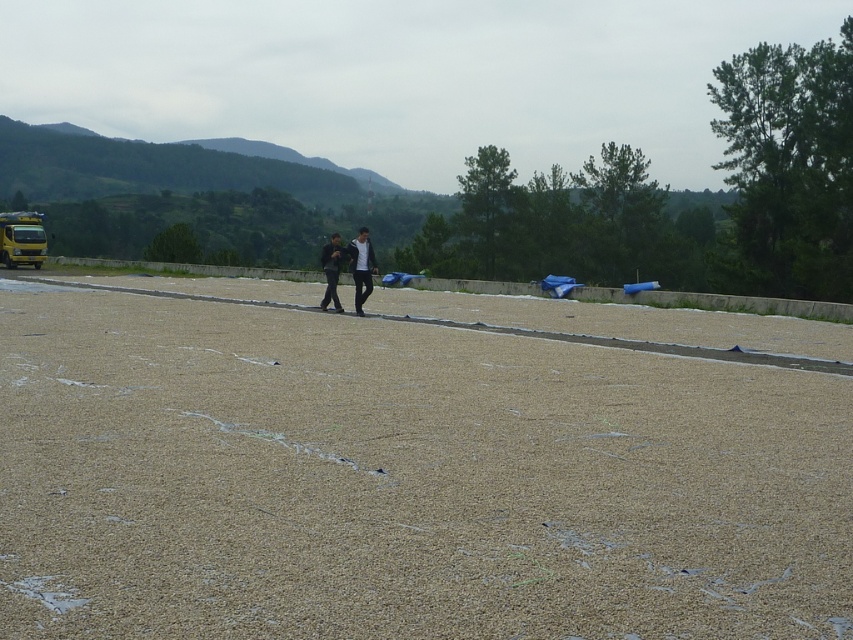
You are a construction worker planning to place a 1.2 meter wide equipment on the sandy surface. The equipment requires a stable base wider than 1.2 meters. Based on the image, can you determine if the brown gravel at center or the dark gray fabric at center provides a wider stable base for the equipment?

The brown gravel at center might be wider than dark gray fabric at center, so it could potentially provide a stable base wider than 1.2 meters. Check the width of the brown gravel at center to confirm.